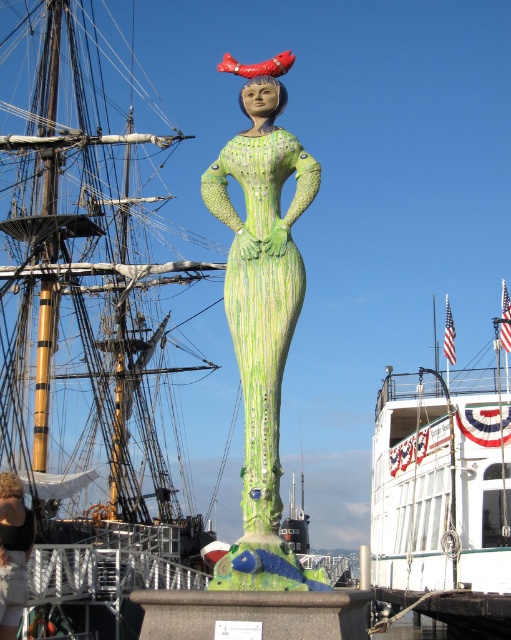
Question: Can you confirm if white glossy boat at lower right is thinner than green textured dress at center?

Choices:
 (A) no
 (B) yes

Answer: (A)

Question: Which point is closer to the camera taking this photo?

Choices:
 (A) (474, 637)
 (B) (9, 612)
 (C) (225, 307)

Answer: (C)

Question: Is white glossy boat at lower right to the left of green textured dress at center from the viewer's perspective?

Choices:
 (A) no
 (B) yes

Answer: (A)

Question: Among these objects, which one is nearest to the camera?

Choices:
 (A) white glossy boat at lower right
 (B) black fabric person at lower left
 (C) green textured dress at center

Answer: (C)

Question: Is white glossy boat at lower right to the left of black fabric person at lower left from the viewer's perspective?

Choices:
 (A) no
 (B) yes

Answer: (A)

Question: Which object is farther from the camera taking this photo?

Choices:
 (A) black fabric person at lower left
 (B) green textured dress at center

Answer: (A)